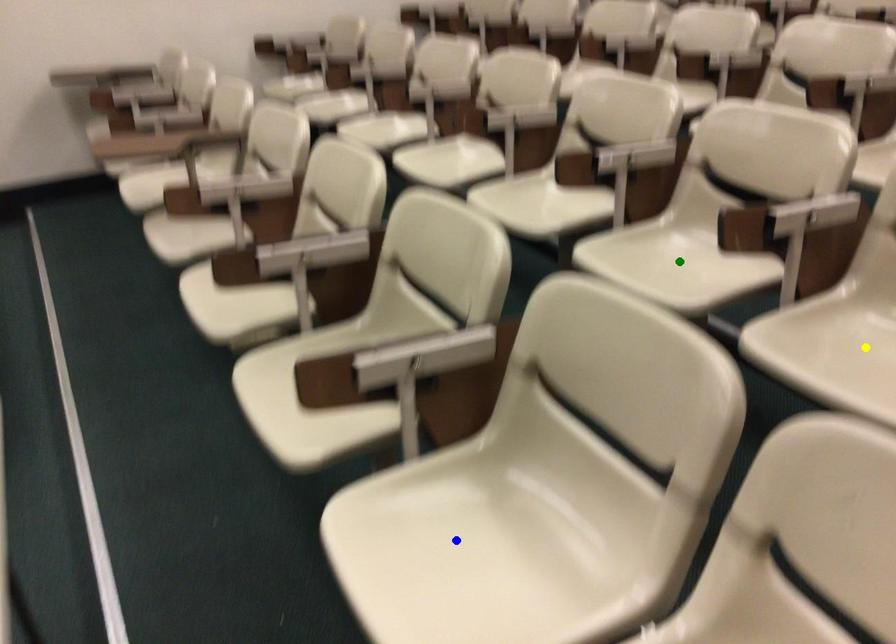
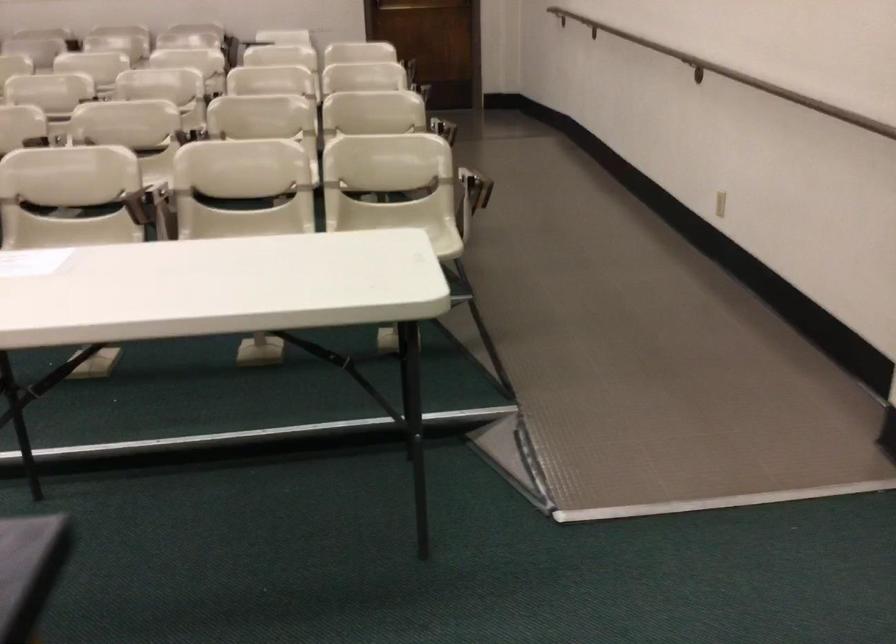
I am providing you with two images of the same scene from different viewpoints. Three points are marked in image1. Which point corresponds to a part or object that is occluded in image2?In image1, three points are marked. Which of them correspond to a part or object that is occluded in image2?Among the three points shown in image1, which one corresponds to a part or object that is no longer visible due to occlusion in image2?

green point, blue point, yellow point